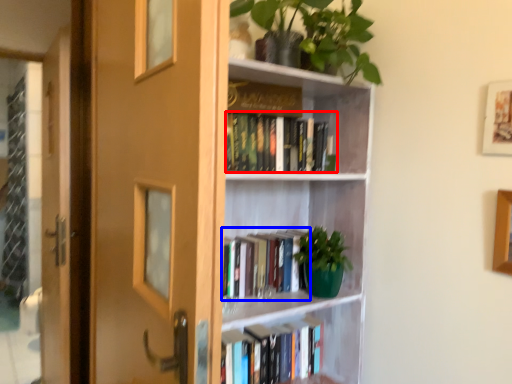
Question: Which point is closer to the camera, book (highlighted by a red box) or book (highlighted by a blue box)?

Choices:
 (A) book
 (B) book

Answer: (A)